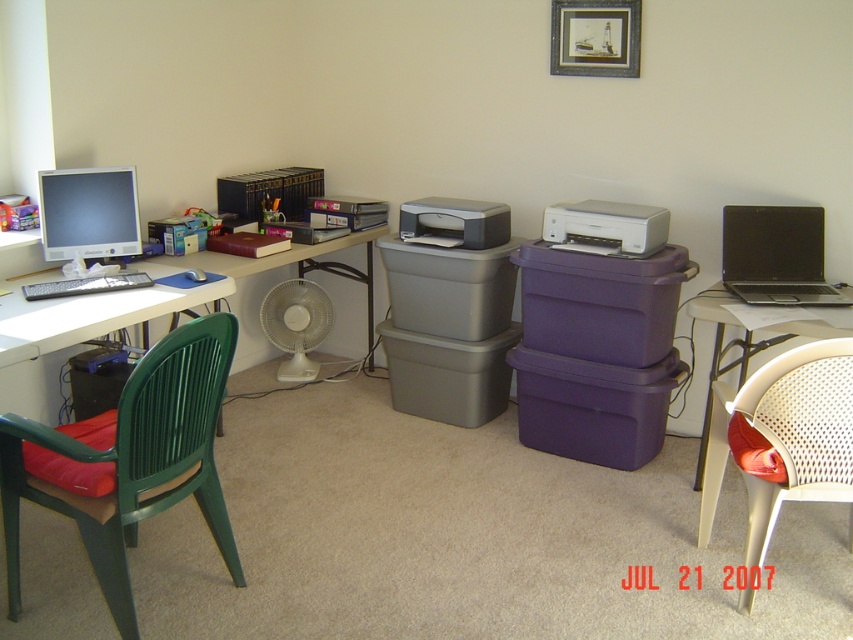
Between white mesh swivel chair at right and black glossy laptop at right, which one appears on the right side from the viewer's perspective?

From the viewer's perspective, black glossy laptop at right appears more on the right side.

Does white mesh swivel chair at right appear over black glossy laptop at right?

Actually, white mesh swivel chair at right is below black glossy laptop at right.

Is point (718, 412) farther from viewer compared to point (817, 214)?

No, (718, 412) is in front of (817, 214).

The width and height of the screenshot is (853, 640). Identify the location of white mesh swivel chair at right. (786, 436).

Who is higher up, black glossy laptop at right or white plastic chair at right?

black glossy laptop at right

The width and height of the screenshot is (853, 640). I want to click on black glossy laptop at right, so click(775, 256).

Locate an element on the screen. black glossy laptop at right is located at coordinates (775, 256).

Which is behind, point (364, 230) or point (97, 209)?

Point (364, 230)

Between white plastic computer desk at left and matte black monitor at left, which one is positioned higher?

matte black monitor at left is higher up.

Is point (10, 294) positioned before point (62, 218)?

Yes, it is.

Find the location of a particular element. white plastic computer desk at left is located at coordinates (83, 317).